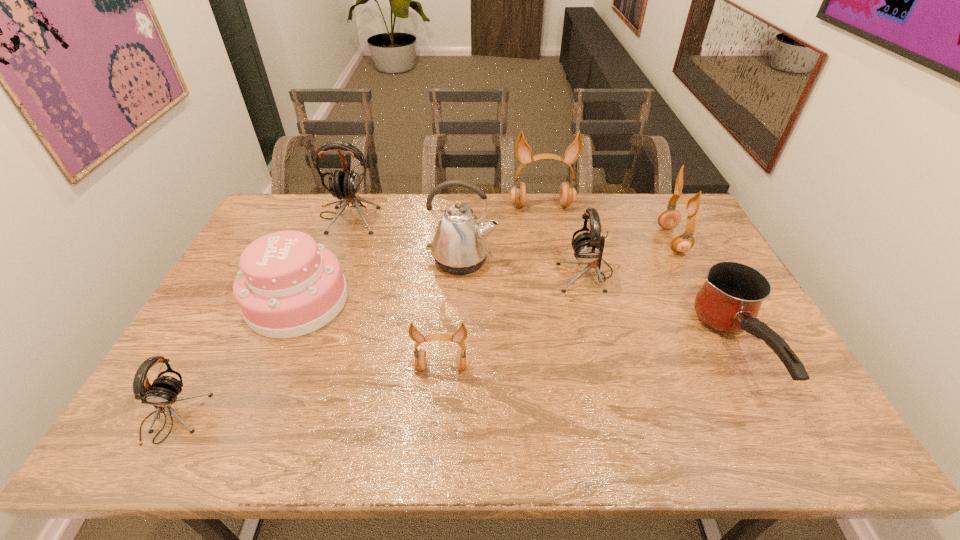
Identify which earphone is the third closest to the biggest black earphone. Please provide its 2D coordinates. Your answer should be formatted as a tuple, i.e. [(x, y)], where the tuple contains the x and y coordinates of a point satisfying the conditions above.

[(588, 247)]

Identify which earphone is the third nearest to the second farthest brown earphone. Please provide its 2D coordinates. Your answer should be formatted as a tuple, i.e. [(x, y)], where the tuple contains the x and y coordinates of a point satisfying the conditions above.

[(419, 358)]

The height and width of the screenshot is (540, 960). I want to click on brown earphone object that ranks as the closest to the second nearest brown earphone, so click(x=523, y=152).

Choose which brown earphone is the third nearest neighbor to the kettle. Please provide its 2D coordinates. Your answer should be formatted as a tuple, i.e. [(x, y)], where the tuple contains the x and y coordinates of a point satisfying the conditions above.

[(670, 218)]

You are a GUI agent. You are given a task and a screenshot of the screen. Output one action in this format:
    pyautogui.click(x=<x>, y=<y>)
    Task: Click on the black earphone that is the closest to the farthest brown earphone
    This screenshot has height=540, width=960.
    Given the screenshot: What is the action you would take?
    pyautogui.click(x=588, y=247)

Select which black earphone appears as the third closest to the second brown earphone from left to right. Please provide its 2D coordinates. Your answer should be formatted as a tuple, i.e. [(x, y)], where the tuple contains the x and y coordinates of a point satisfying the conditions above.

[(163, 392)]